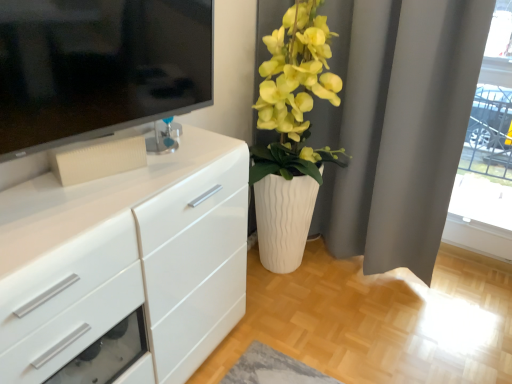
This screenshot has width=512, height=384. Identify the location of vacant space that is in between matte white vase at center right and white matte curtain at upper right. (346, 296).